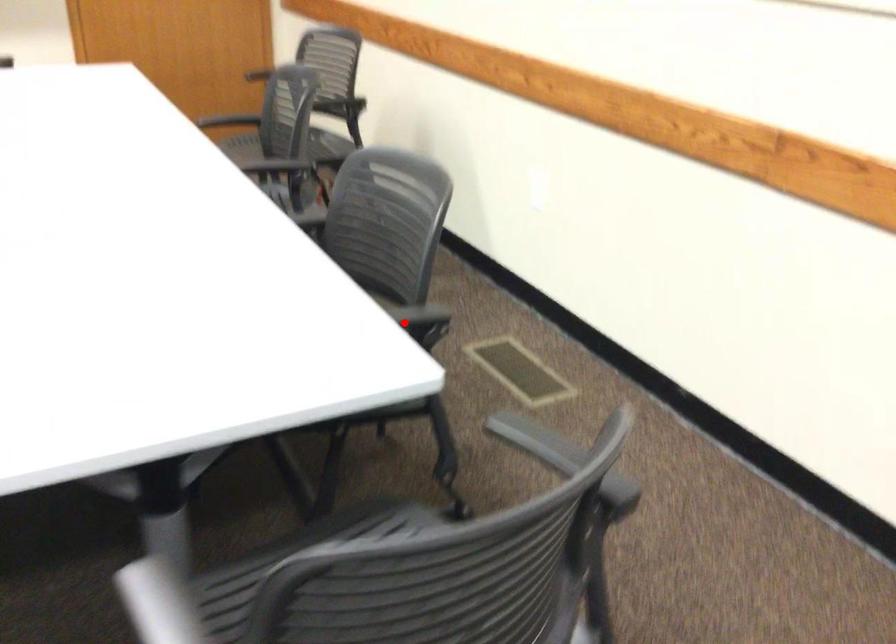
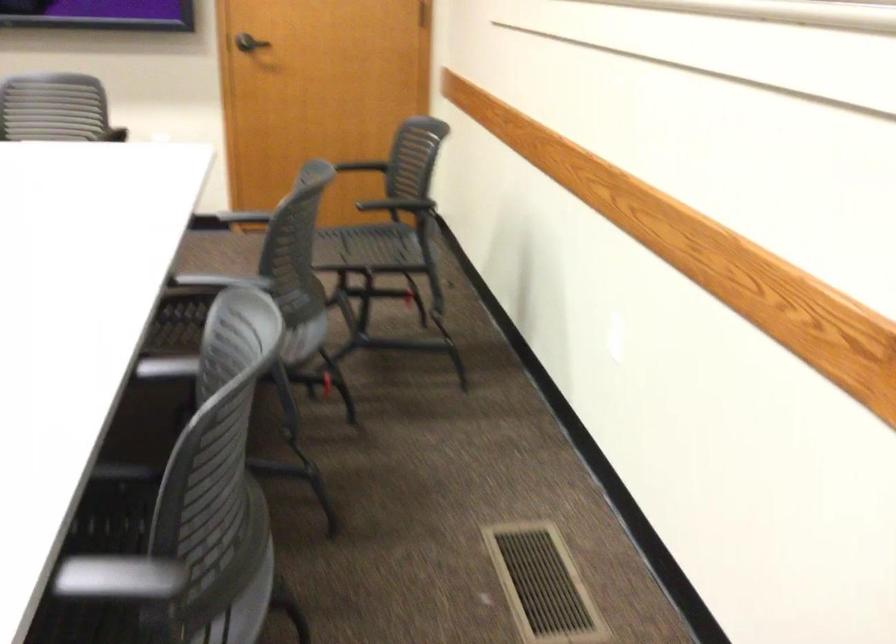
Question: I am providing you with two images of the same scene from different viewpoints. Image1 has a red point marked. In image2, the corresponding 3D location appears at what relative position? Reply with the corresponding letter.

Choices:
 (A) Closer
 (B) Farther

Answer: (A)